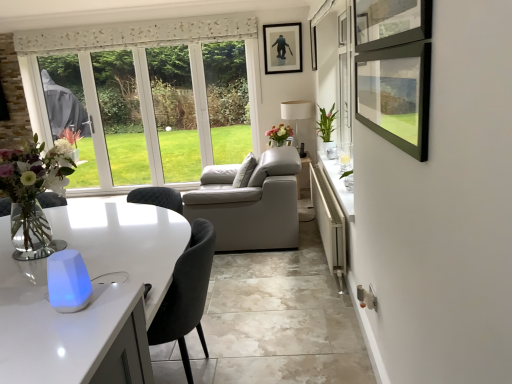
Question: Does white glossy counter at lower right appear on the right side of green glossy vase at upper right, the 2th flower in the back-to-front sequence?

Choices:
 (A) yes
 (B) no

Answer: (B)

Question: Is white glossy counter at lower right shorter than green glossy vase at upper right, the 2th flower in the back-to-front sequence?

Choices:
 (A) no
 (B) yes

Answer: (B)

Question: From the image's perspective, does white glossy counter at lower right appear lower than green glossy vase at upper right, the second flower positioned from the left?

Choices:
 (A) no
 (B) yes

Answer: (B)

Question: Would you say white glossy counter at lower right contains green glossy vase at upper right, placed as the first flower when sorted from front to back?

Choices:
 (A) no
 (B) yes

Answer: (A)

Question: Does white glossy counter at lower right have a smaller size compared to green glossy vase at upper right, the first flower when ordered from right to left?

Choices:
 (A) no
 (B) yes

Answer: (A)

Question: Does white glossy counter at lower right have a greater height compared to green glossy vase at upper right, placed as the first flower when sorted from front to back?

Choices:
 (A) yes
 (B) no

Answer: (B)

Question: Is white matte lamp at center smaller than green glossy vase at upper right, the 2th flower in the back-to-front sequence?

Choices:
 (A) no
 (B) yes

Answer: (A)

Question: Does white matte lamp at center appear on the left side of green glossy vase at upper right, placed as the first flower when sorted from front to back?

Choices:
 (A) yes
 (B) no

Answer: (A)

Question: Are white matte lamp at center and green glossy vase at upper right, the second flower positioned from the left, beside each other?

Choices:
 (A) no
 (B) yes

Answer: (A)

Question: Considering the relative positions of white matte lamp at center and green glossy vase at upper right, placed as the first flower when sorted from front to back, in the image provided, is white matte lamp at center in front of green glossy vase at upper right, placed as the first flower when sorted from front to back,?

Choices:
 (A) no
 (B) yes

Answer: (A)

Question: Considering the relative sizes of white matte lamp at center and green glossy vase at upper right, placed as the first flower when sorted from front to back, in the image provided, is white matte lamp at center bigger than green glossy vase at upper right, placed as the first flower when sorted from front to back,?

Choices:
 (A) yes
 (B) no

Answer: (A)

Question: Is white matte lamp at center aimed at green glossy vase at upper right, the first flower when ordered from right to left?

Choices:
 (A) no
 (B) yes

Answer: (A)

Question: Considering the relative positions of translucent glass vase at center, which ranks as the first flower in back-to-front order, and white matte lamp at center in the image provided, is translucent glass vase at center, which ranks as the first flower in back-to-front order, to the right of white matte lamp at center from the viewer's perspective?

Choices:
 (A) no
 (B) yes

Answer: (A)